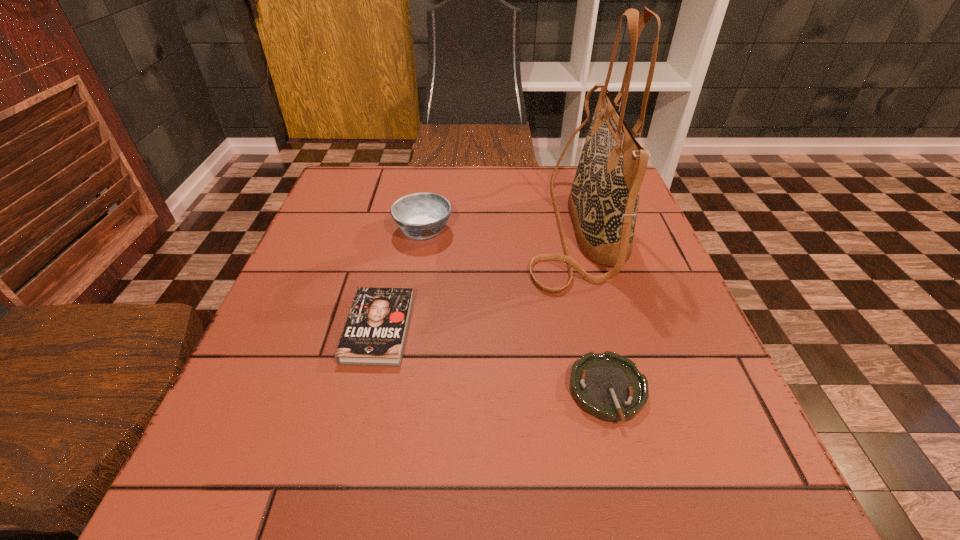
The image size is (960, 540). I want to click on free spot at the left edge of the desktop, so click(x=280, y=332).

This screenshot has width=960, height=540. Find the location of `free region at the right edge`. free region at the right edge is located at coordinates (619, 298).

Where is `vacant space at the far left corner of the desktop`? vacant space at the far left corner of the desktop is located at coordinates (364, 199).

What are the coordinates of `vacant region at the near right corner of the desktop` in the screenshot? It's located at (711, 496).

This screenshot has height=540, width=960. I want to click on free space between the book and the right ashtray, so click(x=493, y=360).

Where is `vacant point located between the book and the left ashtray`? vacant point located between the book and the left ashtray is located at coordinates (401, 279).

You are a GUI agent. You are given a task and a screenshot of the screen. Output one action in this format:
    pyautogui.click(x=<x>, y=<y>)
    Task: Click on the unoccupied position between the shorter ashtray and the second tallest object
    This screenshot has width=960, height=540.
    Given the screenshot: What is the action you would take?
    pyautogui.click(x=516, y=310)

I want to click on unoccupied area between the left ashtray and the handbag, so [498, 228].

In order to click on empty space that is in between the shorter ashtray and the tallest object in this screenshot , I will do `click(590, 308)`.

Locate an element on the screen. unoccupied area between the taller ashtray and the handbag is located at coordinates (498, 228).